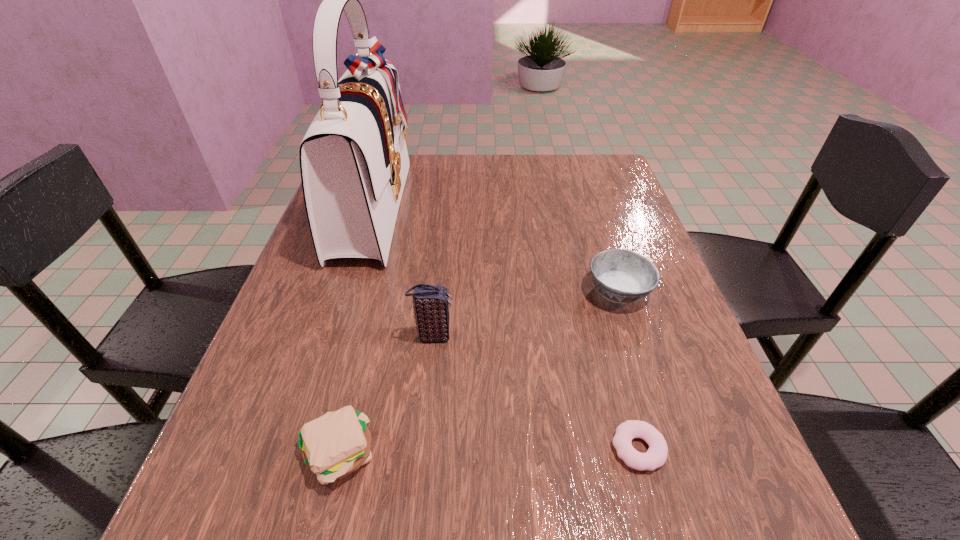
Locate an element on the screen. The image size is (960, 540). vacant space situated on the front of the doughnut is located at coordinates (655, 510).

Find the location of a particular element. Image resolution: width=960 pixels, height=540 pixels. object present at the far edge is located at coordinates (354, 162).

The height and width of the screenshot is (540, 960). What are the coordinates of `object positioned at the near edge` in the screenshot? It's located at (333, 446).

I want to click on satchel located in the left edge section of the desktop, so click(x=354, y=162).

Locate an element on the screen. This screenshot has height=540, width=960. patty present at the left edge is located at coordinates (333, 446).

Identify the location of ashtray located in the right edge section of the desktop. The image size is (960, 540). (622, 276).

Locate an element on the screen. This screenshot has height=540, width=960. doughnut that is positioned at the right edge is located at coordinates (656, 455).

Where is `object that is at the far left corner`? The image size is (960, 540). object that is at the far left corner is located at coordinates (354, 162).

The height and width of the screenshot is (540, 960). Find the location of `object situated at the near left corner`. object situated at the near left corner is located at coordinates (333, 446).

Locate an element on the screen. The width and height of the screenshot is (960, 540). free region at the far edge is located at coordinates (454, 190).